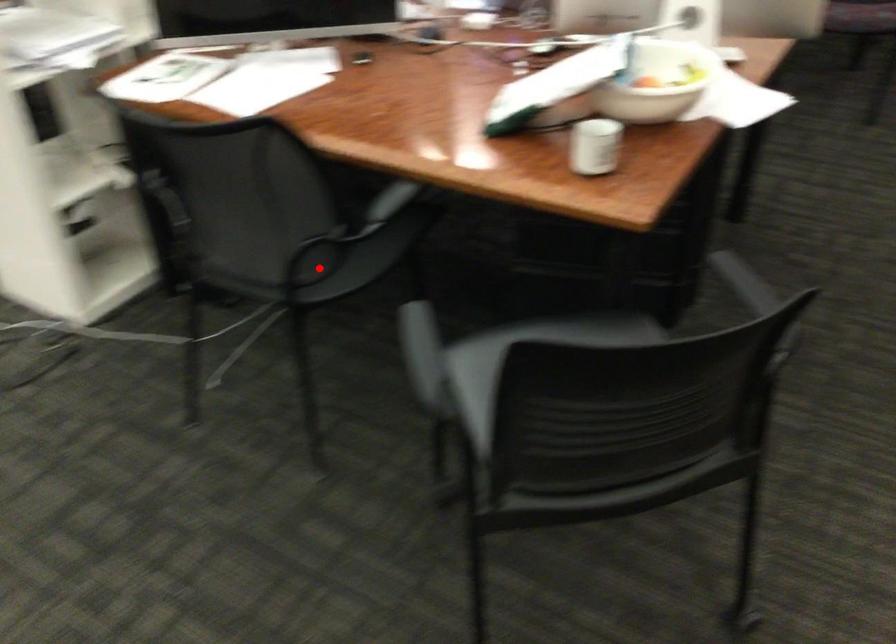
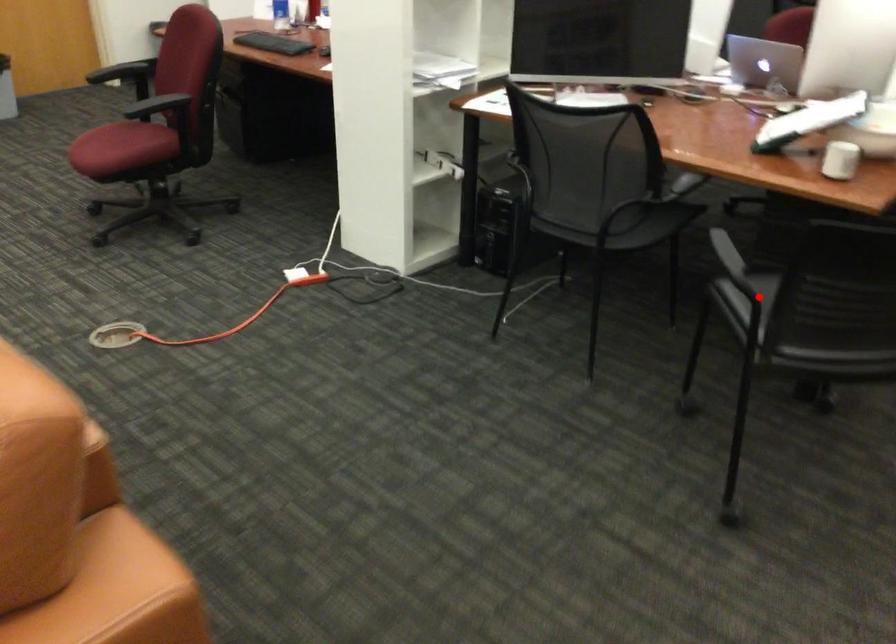
I am providing you with two images of the same scene from different viewpoints. A red point is marked on the first image and another point is marked on the second image. Is the marked point in image1 the same physical position as the marked point in image2?

No